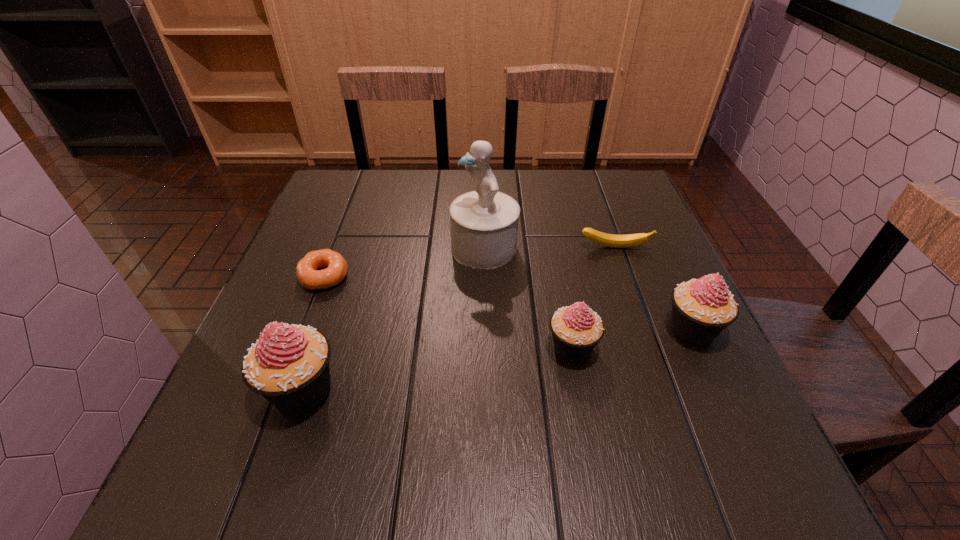
The image size is (960, 540). In order to click on the leftmost cupcake in this screenshot , I will do `click(289, 365)`.

This screenshot has width=960, height=540. What are the coordinates of `the fourth object from left to right` in the screenshot? It's located at (576, 329).

This screenshot has width=960, height=540. In order to click on the second cupcake from right to left in this screenshot , I will do `click(576, 329)`.

Where is `the rightmost cupcake`? The height and width of the screenshot is (540, 960). the rightmost cupcake is located at coordinates (702, 308).

Where is `the fourth shortest object`? Image resolution: width=960 pixels, height=540 pixels. the fourth shortest object is located at coordinates (702, 308).

This screenshot has width=960, height=540. What are the coordinates of `figurine` in the screenshot? It's located at (484, 223).

The width and height of the screenshot is (960, 540). In order to click on the third object from left to right in this screenshot , I will do `click(484, 223)`.

The width and height of the screenshot is (960, 540). I want to click on the shortest object, so click(x=309, y=276).

Where is `the second shortest object`? Image resolution: width=960 pixels, height=540 pixels. the second shortest object is located at coordinates click(x=610, y=240).

This screenshot has width=960, height=540. Identify the location of vacant position located 0.260m on the right of the leftmost cupcake. (488, 390).